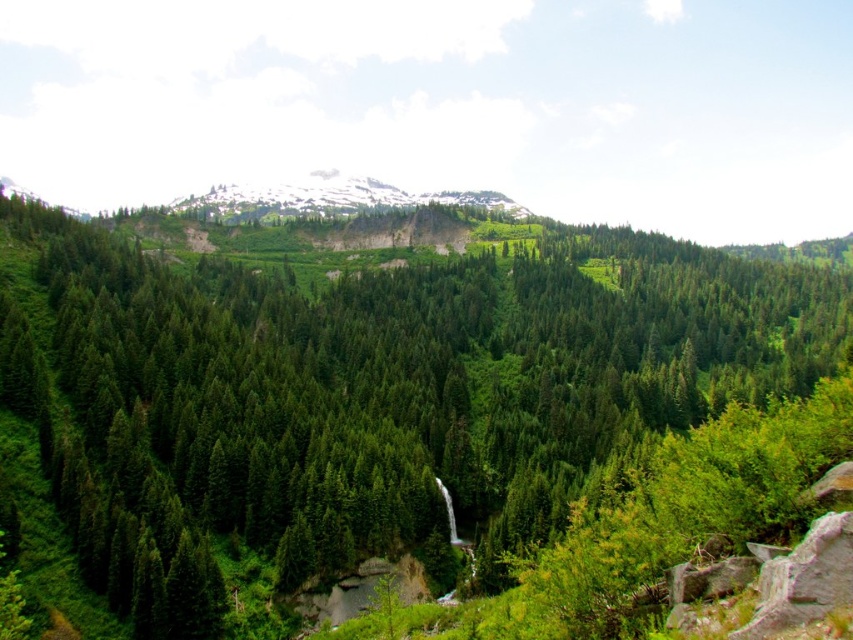
You are a hiker standing at the base of the green matte tree at center and want to reach the snowy rocky mountain at upper center. Which object would you need to climb first?

The green matte tree at center is much taller than the snowy rocky mountain at upper center, so you would need to climb the green matte tree at center first.

You are standing at the point marked as point [370,396] in the image. What object is exactly at your current location?

The green matte tree at center is exactly at point [370,396].